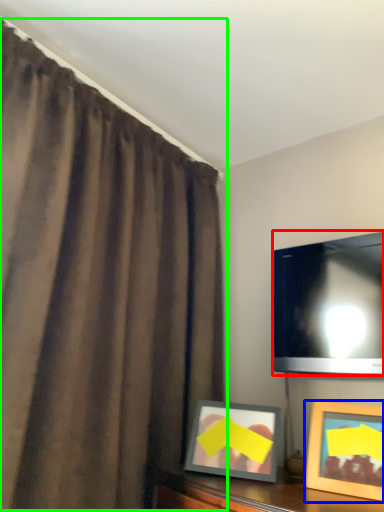
Question: Which object is the farthest from television (highlighted by a red box)? Choose among these: picture frame (highlighted by a blue box) or curtain (highlighted by a green box).

Choices:
 (A) picture frame
 (B) curtain

Answer: (B)